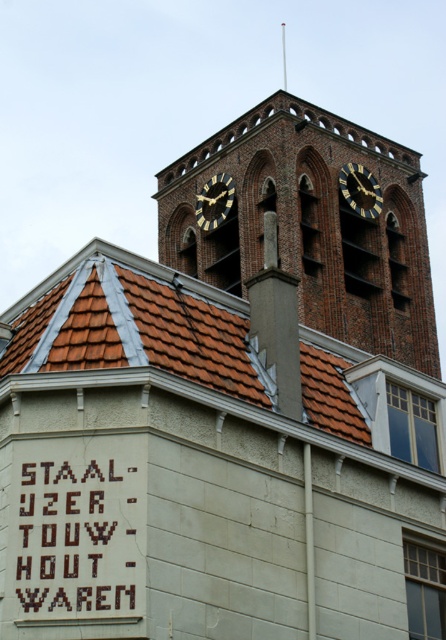
You are an architect examining the building. You notice the brown tile roof at upper center and the goldmetallicclock at upper center. Which object is located higher up in the image?

The goldmetallicclock at upper center is higher up because the brown tile roof at upper center is positioned under it.

You are a maintenance worker assessing the building. You need to determine which object, the brown tile roof at upper center or the goldmetallicclock at upper center, is taller. Based on the scene, which one is taller?

The brown tile roof at upper center is taller than the goldmetallicclock at upper center according to the description.

You are an architect designing a scale model of this building. You have to ensure the brown tile roof at upper center and the goldmetallicclock tower at upper center are proportionate. Which object should be made larger in the model to maintain accuracy?

The brown tile roof at upper center should be made larger in the model since it is larger in size than the goldmetallicclock tower at upper center in the actual building.